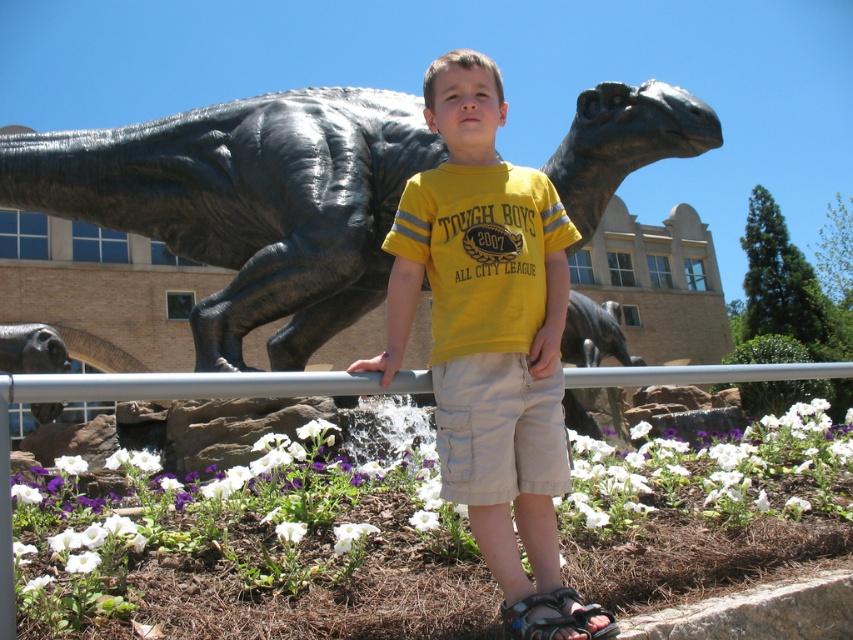
You are a photographer trying to capture the boy in the yellow cotton shirt at center and the shiny black statue at lower left in the same frame. Based on their sizes, which object would appear smaller in the photo?

The yellow cotton shirt at center would appear smaller in the photo because it is thinner than the shiny black statue at lower left.

You are a photographer trying to capture a clear shot of the shiny black statue at lower left without the yellow cotton shirt at center blocking it. How should you adjust your position?

Move your position so that the shiny black statue at lower left is no longer behind the yellow cotton shirt at center. Since the yellow cotton shirt at center is closer to you, moving to the side or adjusting your angle could allow you to see around it to capture the statue.